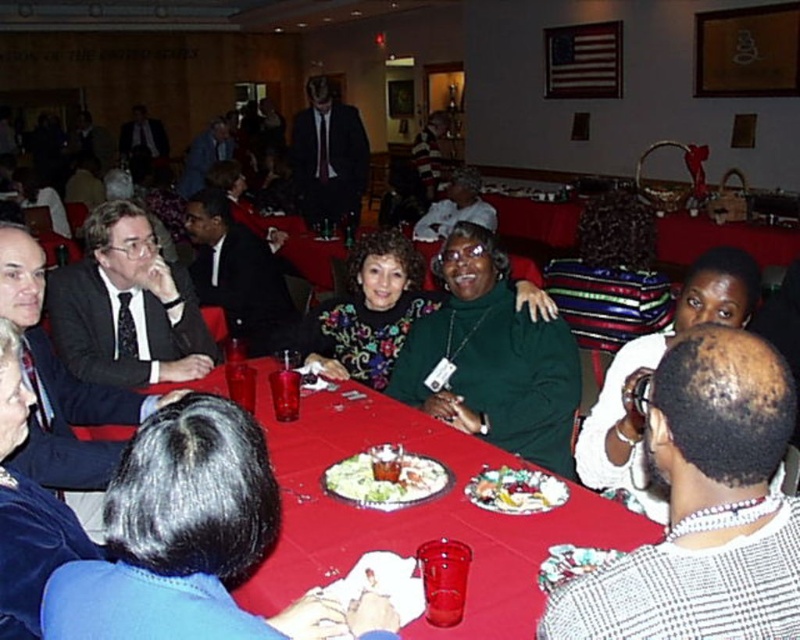
You are a photographer at the event and need to capture a photo of both the green matte sweater at center and the dark suit at center. Which one should you focus on first if you want to ensure both are in frame without adjusting your camera angle?

You should focus on the dark suit at center first because it is taller than the green matte sweater at center, allowing you to frame both without needing to adjust the camera angle.

You are at a social gathering and want to locate the green matte sweater at center and the white fabric at upper right. Which one is positioned to the right side?

The white fabric at upper right is positioned to the right side because the green matte sweater at center is to the left of it.

You are at a banquet hall and see a white plastic plate at center and a colorful salad at center. Which item is positioned to the right of the other?

The white plastic plate at center is to the left of the colorful salad at center, so the colorful salad at center is positioned to the right of the white plastic plate at center.